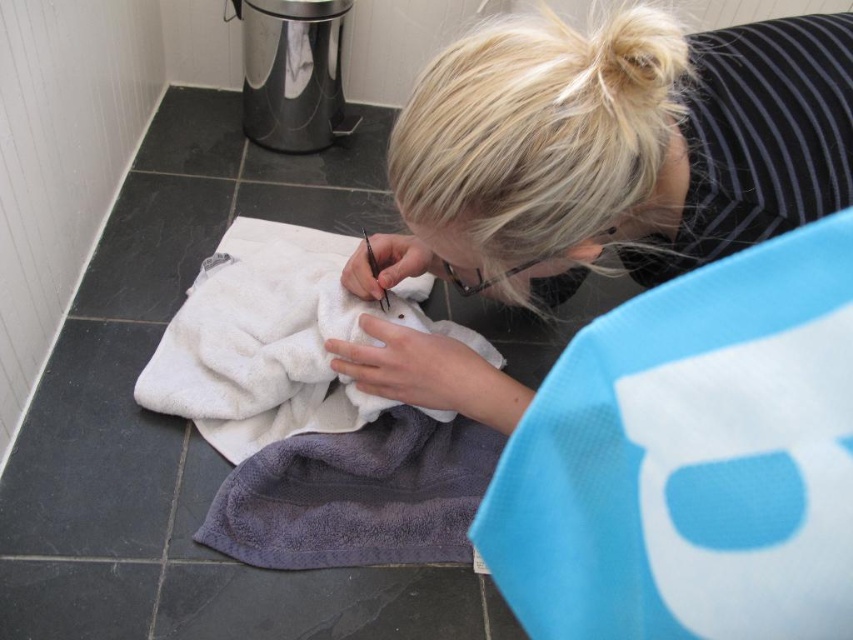
Is point (437, 332) farther from camera compared to point (422, 518)?

Yes, point (437, 332) is farther from viewer.

Is white soft towel at center in front of gray terry towel at lower center?

A: That is False.

What do you see at coordinates (276, 340) in the screenshot?
I see `white soft towel at center` at bounding box center [276, 340].

This screenshot has height=640, width=853. I want to click on white soft towel at center, so click(x=276, y=340).

Can you confirm if blonde hair at center is positioned above gray terry towel at lower center?

Indeed, blonde hair at center is positioned over gray terry towel at lower center.

Between blonde hair at center and gray terry towel at lower center, which one has less height?

With less height is gray terry towel at lower center.

Is point (670, 122) behind point (364, 452)?

No, (670, 122) is closer to viewer.

Locate an element on the screen. blonde hair at center is located at coordinates (613, 148).

Which is behind, point (729, 236) or point (222, 296)?

Positioned behind is point (222, 296).

Does blonde hair at center appear on the left side of white soft towel at center?

Incorrect, blonde hair at center is not on the left side of white soft towel at center.

Where is `blonde hair at center`? The width and height of the screenshot is (853, 640). blonde hair at center is located at coordinates (613, 148).